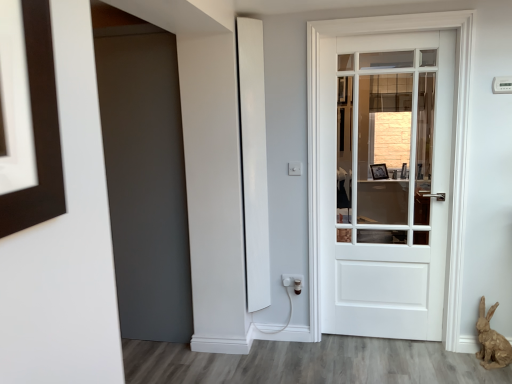
Question: From a real-world perspective, is white matte door at center physically located above or below brown papier-mâché rabbit at lower right?

Choices:
 (A) below
 (B) above

Answer: (B)

Question: Considering the positions of point (357, 208) and point (496, 355), is point (357, 208) closer or farther from the camera than point (496, 355)?

Choices:
 (A) farther
 (B) closer

Answer: (A)

Question: Which object is positioned farthest from the white matte door at center?

Choices:
 (A) white plastic electric outlet at lower center
 (B) brown papier-mâché rabbit at lower right

Answer: (A)

Question: Considering the real-world distances, which object is farthest from the brown papier-mâché rabbit at lower right?

Choices:
 (A) white plastic electric outlet at lower center
 (B) white matte door at center

Answer: (B)